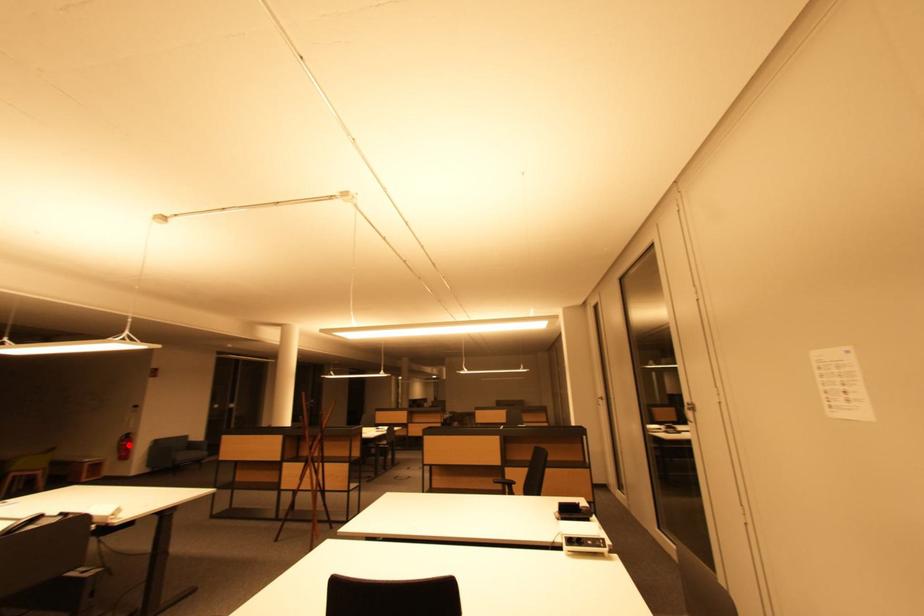
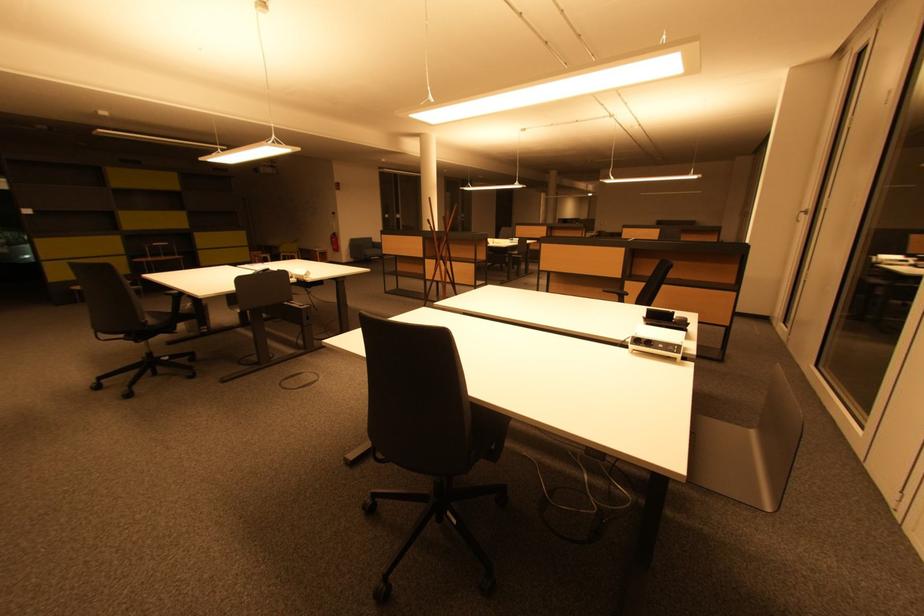
Question: I am providing you with two images of the same scene from different viewpoints. Image1 has a red point marked. In image2, the corresponding 3D location appears at what relative position? Reply with the corresponding letter.

Choices:
 (A) Closer
 (B) Farther

Answer: (A)